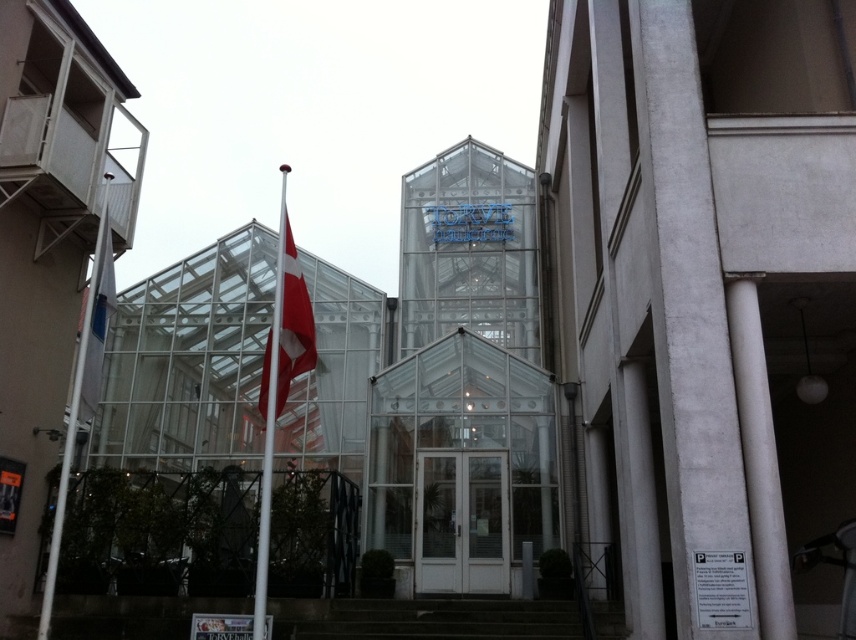
Does concrete stairs at center appear over white metallic flag pole at left?

No.

Is concrete stairs at center behind white metallic flag pole at left?

Yes, concrete stairs at center is behind white metallic flag pole at left.

Between point (547, 600) and point (46, 586), which one is positioned behind?

Point (547, 600)

Image resolution: width=856 pixels, height=640 pixels. I want to click on concrete stairs at center, so click(444, 620).

Which is more to the left, white glass doors at center or white fabric flag at left?

white fabric flag at left is more to the left.

Does white glass doors at center have a greater height compared to white fabric flag at left?

Incorrect, white glass doors at center's height is not larger of white fabric flag at left's.

Find the location of `white glass doors at center`. white glass doors at center is located at coordinates (461, 522).

Find the location of a particular element. Image resolution: width=856 pixels, height=640 pixels. white glass doors at center is located at coordinates (461, 522).

Can you confirm if red fabric flag at center is wider than white metallic flag pole at center?

In fact, red fabric flag at center might be narrower than white metallic flag pole at center.

Is red fabric flag at center further to camera compared to white metallic flag pole at center?

Yes, red fabric flag at center is further from the viewer.

Locate an element on the screen. red fabric flag at center is located at coordinates (287, 326).